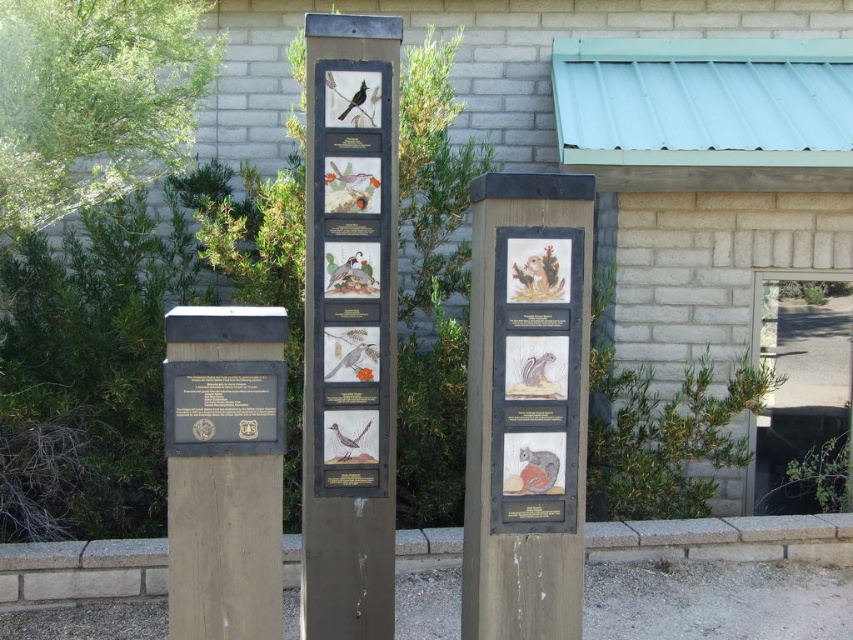
You are standing at the entrance of the building with a teal metal roof. You need to find the wooden signpost at center to get directions. According to the layout, where should you look relative to the building?

The wooden signpost at center is located at point (349,326), which is centrally positioned between the building and the other posts. Look straight ahead from the building entrance towards the middle of the area where the posts are arranged.

You are holding a camera and want to take a photo of the wooden signpost at center. If you are standing 2 meters away from the camera, can you reach the camera to take the photo?

The wooden signpost at center and camera are 3.38 meters apart from each other. Since you are 2 meters away from the camera, the total distance between you and the signpost would be 5.38 meters. However, the question is about reaching the camera, not the signpost. Assuming you are already holding the camera, you can take the photo without needing to move closer. If you need to adjust the camera settings while standing 2 meters away, you might need a remote or someone else to operate it. But physically, you